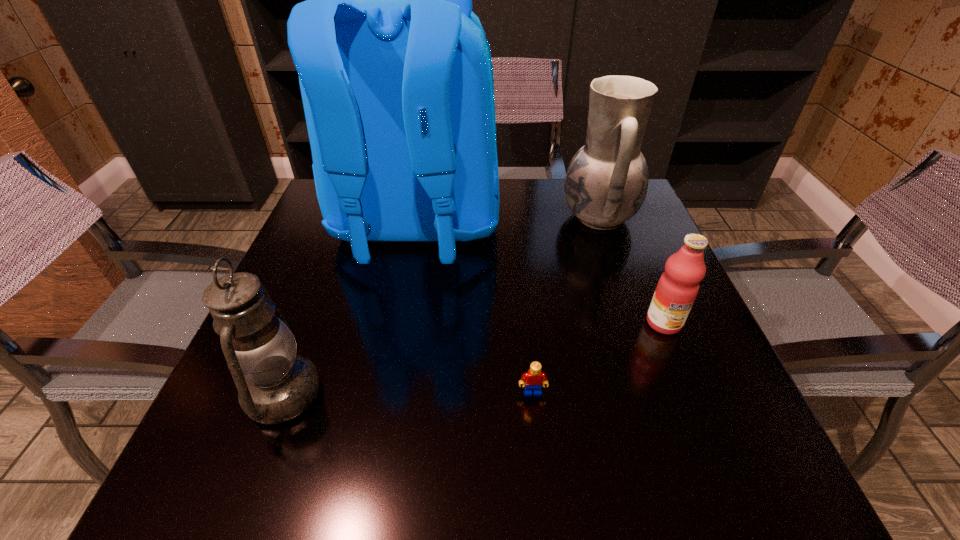
Find the location of `vacant area that lies between the pitcher and the oil lamp`. vacant area that lies between the pitcher and the oil lamp is located at coordinates (441, 306).

Where is `free space between the tallest object and the oil lamp`? This screenshot has height=540, width=960. free space between the tallest object and the oil lamp is located at coordinates (349, 310).

What are the coordinates of `free space between the third nearest object and the oil lamp` in the screenshot? It's located at (473, 358).

Identify the location of free space between the oil lamp and the fruit juice. (473, 358).

This screenshot has height=540, width=960. In order to click on unoccupied position between the pitcher and the oil lamp in this screenshot , I will do `click(441, 306)`.

Image resolution: width=960 pixels, height=540 pixels. Find the location of `free area in between the pitcher and the second shortest object`. free area in between the pitcher and the second shortest object is located at coordinates (x=631, y=270).

Identify the location of unoccupied position between the shortest object and the oil lamp. The width and height of the screenshot is (960, 540). (407, 393).

Identify the location of empty location between the third farthest object and the shortest object. pyautogui.click(x=598, y=357).

This screenshot has height=540, width=960. Identify the location of free point between the pitcher and the oil lamp. (441, 306).

Identify which object is the nearest to the backpack. Please provide its 2D coordinates. Your answer should be formatted as a tuple, i.e. [(x, y)], where the tuple contains the x and y coordinates of a point satisfying the conditions above.

[(606, 183)]